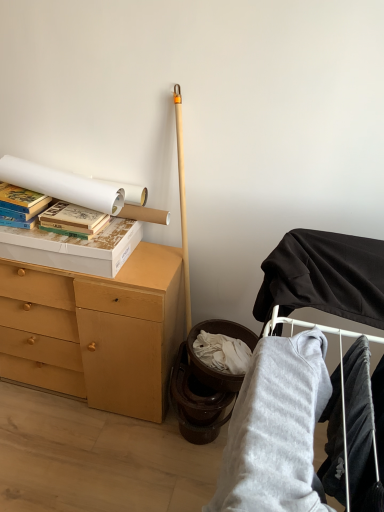
Question: From a real-world perspective, is matte cardboard book at upper left, the 2th paperback book viewed from the left, beneath gray fleece sweatshirt at lower right, positioned as the 2th clothing in right-to-left order?

Choices:
 (A) yes
 (B) no

Answer: (B)

Question: Does matte cardboard book at upper left, which is the first paperback book from right to left, come in front of gray fleece sweatshirt at lower right, the 1th clothing positioned from the left?

Choices:
 (A) no
 (B) yes

Answer: (A)

Question: From a real-world perspective, is matte cardboard book at upper left, which is the first paperback book from right to left, on gray fleece sweatshirt at lower right, the 1th clothing positioned from the left?

Choices:
 (A) no
 (B) yes

Answer: (B)

Question: Does matte cardboard book at upper left, the 2th paperback book viewed from the left, contain gray fleece sweatshirt at lower right, positioned as the 2th clothing in right-to-left order?

Choices:
 (A) no
 (B) yes

Answer: (A)

Question: Is matte cardboard book at upper left, which is the first paperback book from right to left, next to gray fleece sweatshirt at lower right, the 1th clothing positioned from the left, and touching it?

Choices:
 (A) yes
 (B) no

Answer: (B)

Question: Is point (8, 208) closer or farther from the camera than point (210, 506)?

Choices:
 (A) farther
 (B) closer

Answer: (A)

Question: Visually, is hardcover books at left, which is counted as the 2th paperback book, starting from the right, positioned to the left or to the right of gray fleece sweatshirt at lower right, positioned as the 2th clothing in right-to-left order?

Choices:
 (A) left
 (B) right

Answer: (A)

Question: Looking at their shapes, would you say hardcover books at left, which is counted as the 2th paperback book, starting from the right, is wider or thinner than gray fleece sweatshirt at lower right, the 1th clothing positioned from the left?

Choices:
 (A) thin
 (B) wide

Answer: (A)

Question: In terms of size, does hardcover books at left, marked as the first paperback book in a left-to-right arrangement, appear bigger or smaller than gray fleece sweatshirt at lower right, the 1th clothing positioned from the left?

Choices:
 (A) big
 (B) small

Answer: (B)

Question: Relative to hardcover books at left, which is counted as the 2th paperback book, starting from the right, is velvet black pants at lower right, the 2th clothing from the left, in front or behind?

Choices:
 (A) front
 (B) behind

Answer: (A)

Question: Is velvet black pants at lower right, positioned as the first clothing in right-to-left order, wider or thinner than hardcover books at left, which is counted as the 2th paperback book, starting from the right?

Choices:
 (A) thin
 (B) wide

Answer: (A)

Question: Would you say velvet black pants at lower right, the 2th clothing from the left, is inside or outside hardcover books at left, which is counted as the 2th paperback book, starting from the right?

Choices:
 (A) inside
 (B) outside

Answer: (B)

Question: Based on their sizes in the image, would you say velvet black pants at lower right, the 2th clothing from the left, is bigger or smaller than hardcover books at left, which is counted as the 2th paperback book, starting from the right?

Choices:
 (A) big
 (B) small

Answer: (B)

Question: Relative to gray fleece sweatshirt at lower right, positioned as the 2th clothing in right-to-left order, is white cardboard box at upper left in front or behind?

Choices:
 (A) front
 (B) behind

Answer: (B)

Question: Based on their sizes in the image, would you say white cardboard box at upper left is bigger or smaller than gray fleece sweatshirt at lower right, the 1th clothing positioned from the left?

Choices:
 (A) small
 (B) big

Answer: (A)